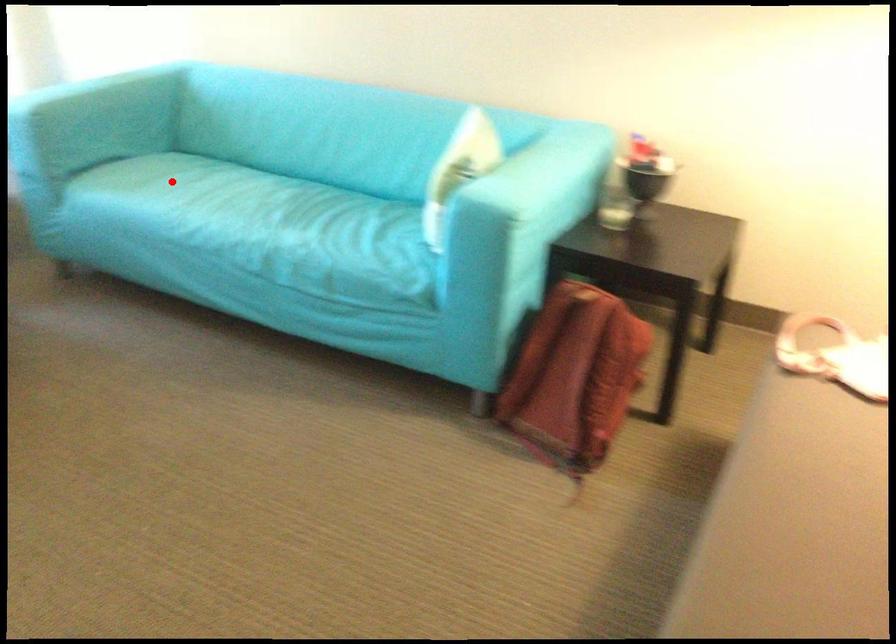
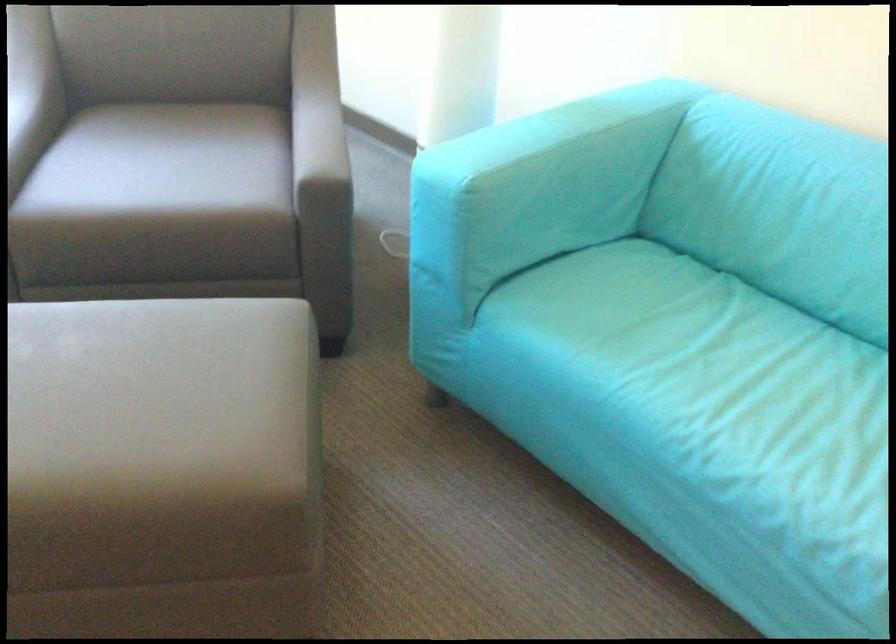
Question: I am providing you with two images of the same scene from different viewpoints. In image1, a red point is highlighted. Considering the same 3D point in image2, which of the following is correct?

Choices:
 (A) It is closer
 (B) It is farther

Answer: (A)